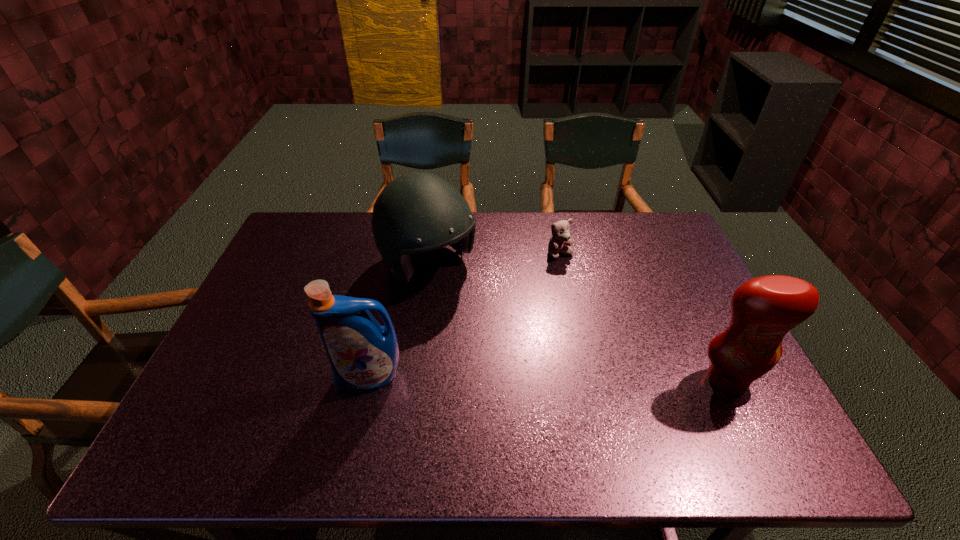
This screenshot has height=540, width=960. In order to click on detergent in this screenshot , I will do click(364, 356).

You are a GUI agent. You are given a task and a screenshot of the screen. Output one action in this format:
    pyautogui.click(x=<x>, y=<y>)
    Task: Click on the condiment
    The image size is (960, 540).
    Given the screenshot: What is the action you would take?
    pyautogui.click(x=763, y=310)

In order to click on teddy bear in this screenshot , I will do `click(559, 242)`.

Identify the location of the shortest object. (559, 242).

Identify the location of football helmet. Image resolution: width=960 pixels, height=540 pixels. point(417,212).

Locate an element on the screen. The image size is (960, 540). free space located 0.390m at the face of the second object from right to left is located at coordinates (595, 361).

Where is `vacant space situated at the face of the second object from right to left`? Image resolution: width=960 pixels, height=540 pixels. vacant space situated at the face of the second object from right to left is located at coordinates (587, 337).

You are a GUI agent. You are given a task and a screenshot of the screen. Output one action in this format:
    pyautogui.click(x=<x>, y=<y>)
    Task: Click on the vacant space situated at the face of the second object from right to left
    Image resolution: width=960 pixels, height=540 pixels.
    Given the screenshot: What is the action you would take?
    pyautogui.click(x=587, y=337)

Find the location of a particular element. free region located at the face opening of the football helmet is located at coordinates (509, 340).

I want to click on free space located 0.380m at the face opening of the football helmet, so click(x=549, y=377).